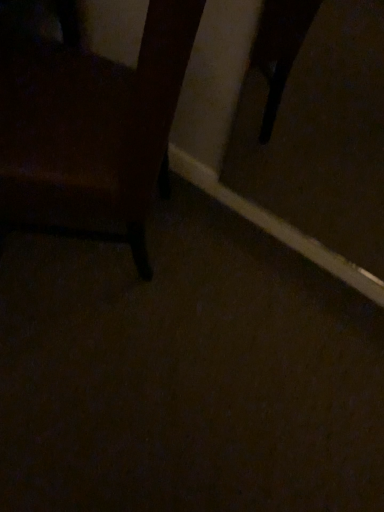
Image resolution: width=384 pixels, height=512 pixels. What do you see at coordinates (90, 129) in the screenshot?
I see `dark wood chair at left` at bounding box center [90, 129].

Find the location of a particular element. dark wood chair at left is located at coordinates (90, 129).

The width and height of the screenshot is (384, 512). I want to click on dark wood chair at left, so click(x=90, y=129).